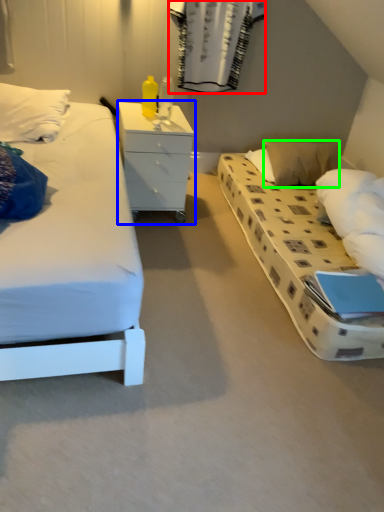
Question: Estimate the real-world distances between objects in this image. Which object is farther from curtain (highlighted by a red box), chest of drawers (highlighted by a blue box) or pillow (highlighted by a green box)?

Choices:
 (A) chest of drawers
 (B) pillow

Answer: (A)